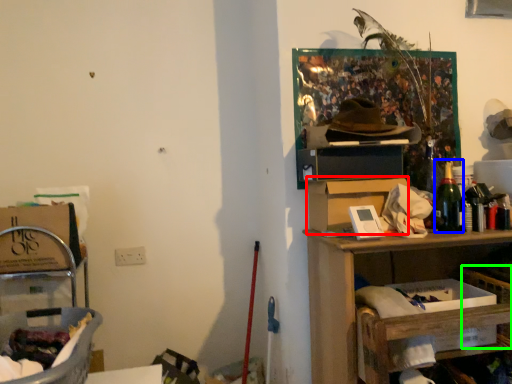
Question: Which is farther away from cardboard box (highlighted by a red box)? bottle (highlighted by a blue box) or basket (highlighted by a green box)?

Choices:
 (A) bottle
 (B) basket

Answer: (B)